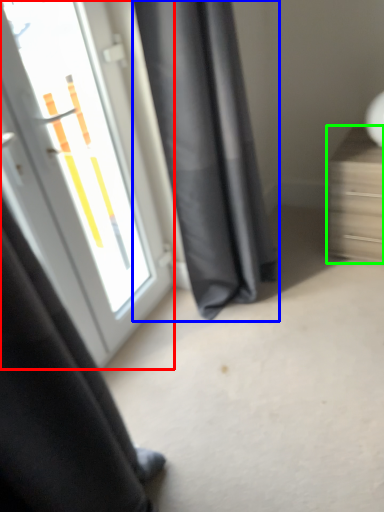
Question: Estimate the real-world distances between objects in this image. Which object is farther from door (highlighted by a red box), curtain (highlighted by a blue box) or furniture (highlighted by a green box)?

Choices:
 (A) curtain
 (B) furniture

Answer: (B)